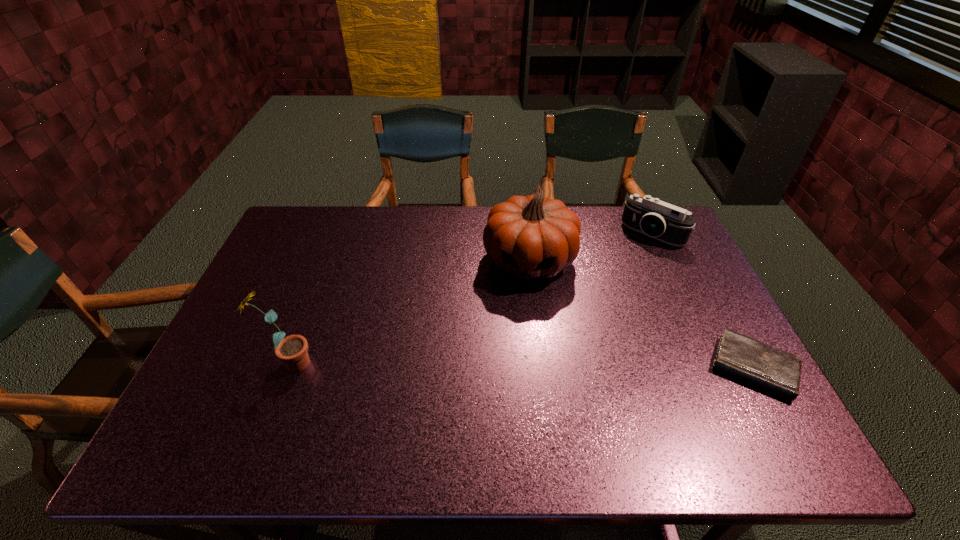
At what (x,y) coordinates should I click in order to perform the action: click on vacant spot on the desktop that is between the sunflower and the diary and is positioned on the face of the pumpkin. Please return your answer as a coordinate pair (x, y). This screenshot has width=960, height=540. Looking at the image, I should click on (512, 366).

This screenshot has width=960, height=540. What are the coordinates of `vacant space on the desktop that is between the leftmost object and the shortest object and is positioned on the front lens of the third tallest object` in the screenshot? It's located at (538, 366).